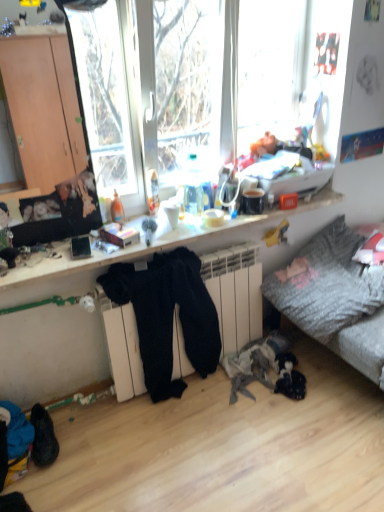
Find the location of a particular element. This screenshot has height=512, width=384. space that is in front of black suede shoes at lower left is located at coordinates (44, 481).